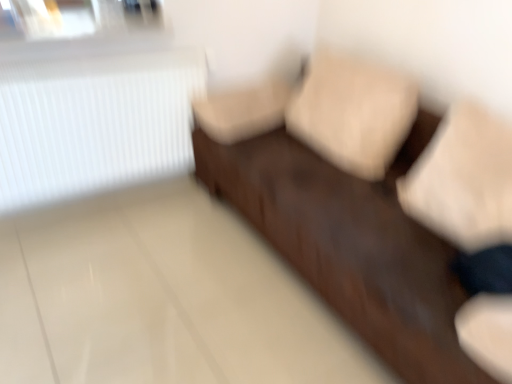
Question: Is white ribbed radiator at upper left inside or outside of dark brown leather couch at center?

Choices:
 (A) inside
 (B) outside

Answer: (B)

Question: From their relative heights in the image, would you say white ribbed radiator at upper left is taller or shorter than dark brown leather couch at center?

Choices:
 (A) short
 (B) tall

Answer: (A)

Question: From a real-world perspective, is white ribbed radiator at upper left positioned above or below dark brown leather couch at center?

Choices:
 (A) below
 (B) above

Answer: (B)

Question: From their relative heights in the image, would you say dark brown leather couch at center is taller or shorter than white ribbed radiator at upper left?

Choices:
 (A) tall
 (B) short

Answer: (A)

Question: Choose the correct answer: Is dark brown leather couch at center inside white ribbed radiator at upper left or outside it?

Choices:
 (A) inside
 (B) outside

Answer: (B)

Question: Does point (224, 195) appear closer or farther from the camera than point (13, 165)?

Choices:
 (A) farther
 (B) closer

Answer: (A)

Question: Looking at their shapes, would you say dark brown leather couch at center is wider or thinner than white ribbed radiator at upper left?

Choices:
 (A) wide
 (B) thin

Answer: (A)